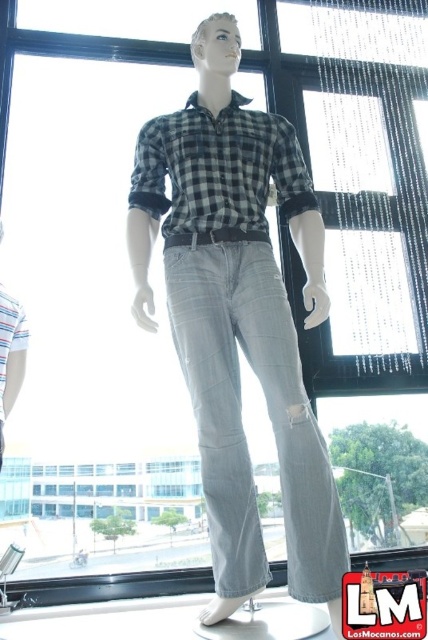
Question: Does light blue denim jeans at center have a larger size compared to checkered fabric shirt at center?

Choices:
 (A) no
 (B) yes

Answer: (B)

Question: Is light blue denim jeans at center to the left of checkered fabric shirt at center from the viewer's perspective?

Choices:
 (A) yes
 (B) no

Answer: (B)

Question: Which of the following is the closest to the observer?

Choices:
 (A) light blue denim jeans at center
 (B) checkered fabric shirt at center

Answer: (A)

Question: Can you confirm if light blue denim jeans at center is positioned above checkered fabric shirt at center?

Choices:
 (A) no
 (B) yes

Answer: (A)

Question: Which object appears farthest from the camera in this image?

Choices:
 (A) checkered fabric shirt at center
 (B) light blue denim jeans at center

Answer: (A)